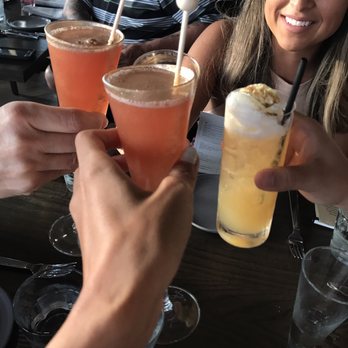
This screenshot has width=348, height=348. I want to click on drinking glasses, so click(x=252, y=156), click(x=156, y=128), click(x=69, y=76), click(x=168, y=57), click(x=317, y=312), click(x=176, y=315), click(x=32, y=304), click(x=62, y=238), click(x=342, y=236).